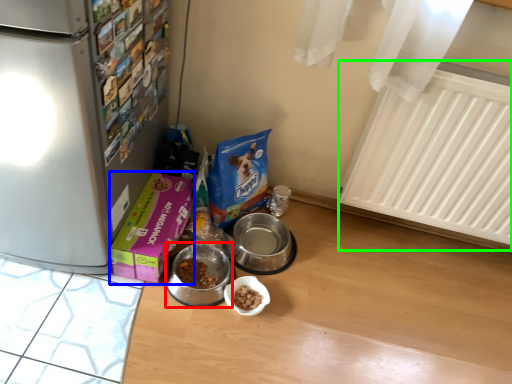
Question: Which object is positioned closest to appliance (highlighted by a red box)? Select from box (highlighted by a blue box) and radiator (highlighted by a green box).

Choices:
 (A) box
 (B) radiator

Answer: (A)